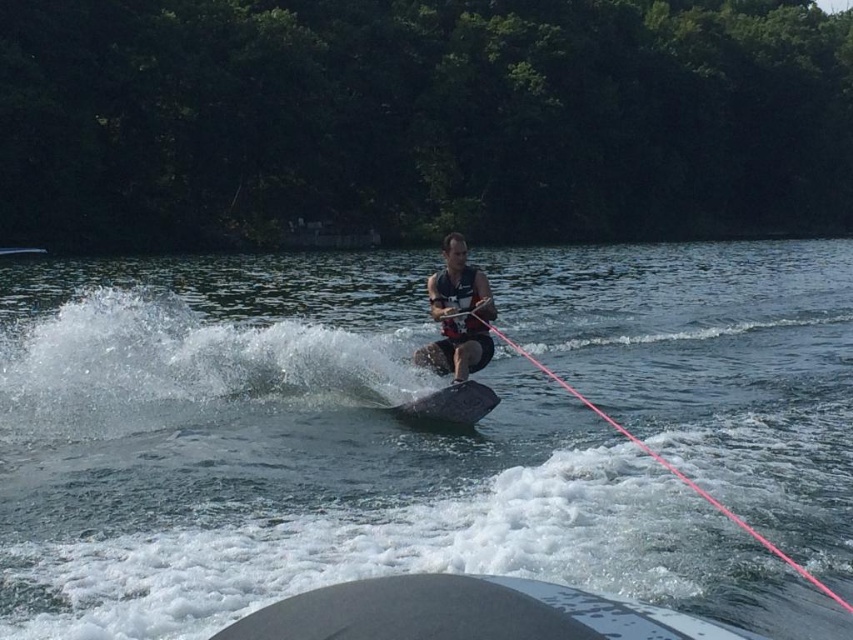
Question: Can you confirm if green leafy trees at upper center is positioned below matte black life vest at center?

Choices:
 (A) no
 (B) yes

Answer: (A)

Question: Among these objects, which one is farthest from the camera?

Choices:
 (A) pink nylon rope at center
 (B) smooth gray boat at center

Answer: (B)

Question: Which object is farther from the camera taking this photo?

Choices:
 (A) matte black life jacket at center
 (B) smooth gray boat at center
 (C) green leafy trees at upper center

Answer: (C)

Question: Is matte black life vest at center thinner than pink nylon rope at center?

Choices:
 (A) yes
 (B) no

Answer: (A)

Question: Is pink nylon rope at center wider than black smooth water ski at center?

Choices:
 (A) no
 (B) yes

Answer: (B)

Question: Which of these objects is positioned closest to the smooth gray boat at center?

Choices:
 (A) matte black life jacket at center
 (B) pink nylon rope at center
 (C) green leafy trees at upper center

Answer: (B)